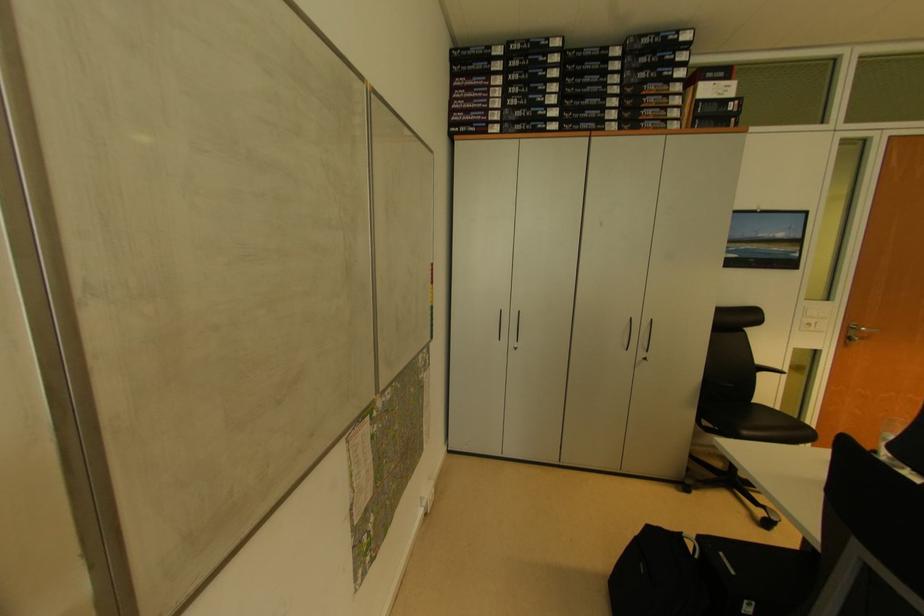
What do you see at coordinates (857, 333) in the screenshot? I see `the silver door handle` at bounding box center [857, 333].